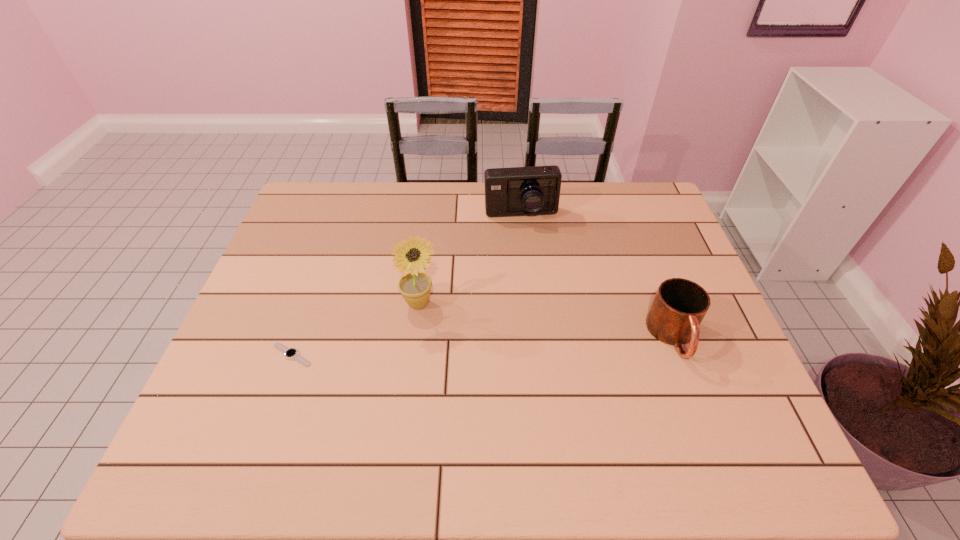
Identify the location of free point between the shortest object and the mug. The width and height of the screenshot is (960, 540). (483, 346).

I want to click on blank region between the second shortest object and the second object from left to right, so click(x=547, y=320).

The width and height of the screenshot is (960, 540). Identify the location of vacant space that is in between the mug and the camera. (597, 276).

Where is `the closest object to the tallest object`? This screenshot has height=540, width=960. the closest object to the tallest object is located at coordinates (290, 353).

The width and height of the screenshot is (960, 540). Find the location of `object that ranks as the second closest to the tallest object`. object that ranks as the second closest to the tallest object is located at coordinates (517, 191).

I want to click on free space that satisfies the following two spatial constraints: 1. on the back side of the third object from left to right; 2. on the right side of the leftmost object, so click(341, 215).

Where is `vacant space that satisfies the following two spatial constraints: 1. on the back side of the watch; 2. on the right side of the tallest object`? This screenshot has width=960, height=540. vacant space that satisfies the following two spatial constraints: 1. on the back side of the watch; 2. on the right side of the tallest object is located at coordinates (310, 303).

You are a GUI agent. You are given a task and a screenshot of the screen. Output one action in this format:
    pyautogui.click(x=<x>, y=<y>)
    Task: Click on the free space in the image that satisfies the following two spatial constraints: 1. on the back side of the shortest object; 2. on the left side of the sunflower
    Image resolution: width=960 pixels, height=540 pixels.
    Given the screenshot: What is the action you would take?
    pyautogui.click(x=310, y=303)